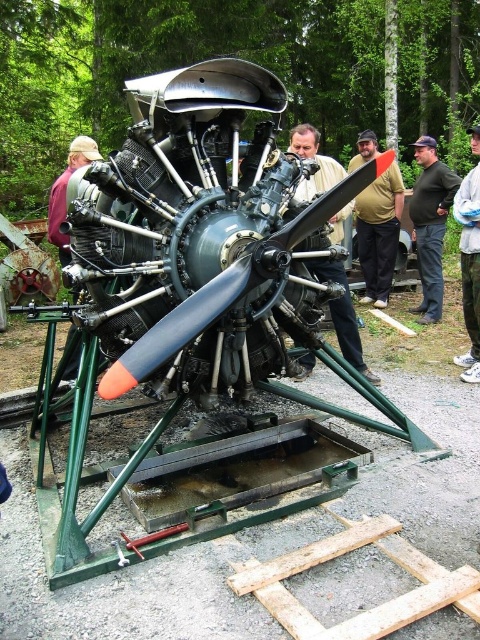
Can you confirm if dark green pants at center is positioned above matte black propeller at center?

Correct, dark green pants at center is located above matte black propeller at center.

Which is more to the right, dark green pants at center or matte black propeller at center?

Positioned to the right is dark green pants at center.

Is point (448, 186) less distant than point (315, 264)?

No, (448, 186) is behind (315, 264).

Identify the location of dark green pants at center. tap(431, 224).

Which is more to the left, matte black propeller at center or camouflage pants at center?

matte black propeller at center is more to the left.

Identify the location of matte black propeller at center. The image size is (480, 640). (343, 316).

The height and width of the screenshot is (640, 480). I want to click on fat man at center, so click(x=379, y=234).

In the scene shown: Can you confirm if fat man at center is smaller than matte black propeller at center?

Correct, fat man at center occupies less space than matte black propeller at center.

Image resolution: width=480 pixels, height=640 pixels. What are the coordinates of `fat man at center` in the screenshot? It's located at (379, 234).